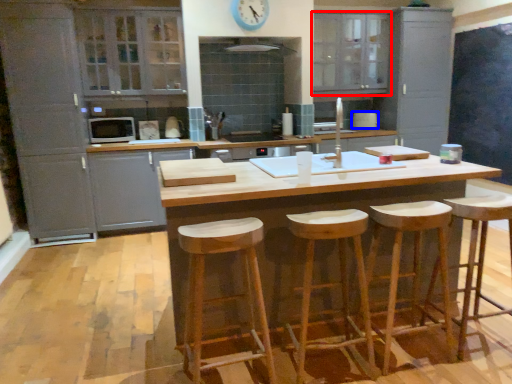
Question: Which point is closer to the camera, cabinetry (highlighted by a red box) or appliance (highlighted by a blue box)?

Choices:
 (A) cabinetry
 (B) appliance

Answer: (A)